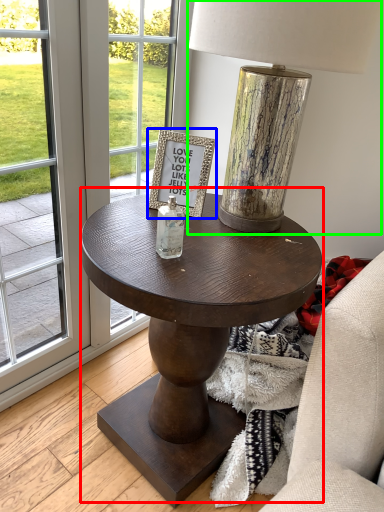
Question: Considering the real-world distances, which object is farthest from coffee table (highlighted by a red box)? picture frame (highlighted by a blue box) or table lamp (highlighted by a green box)?

Choices:
 (A) picture frame
 (B) table lamp

Answer: (B)